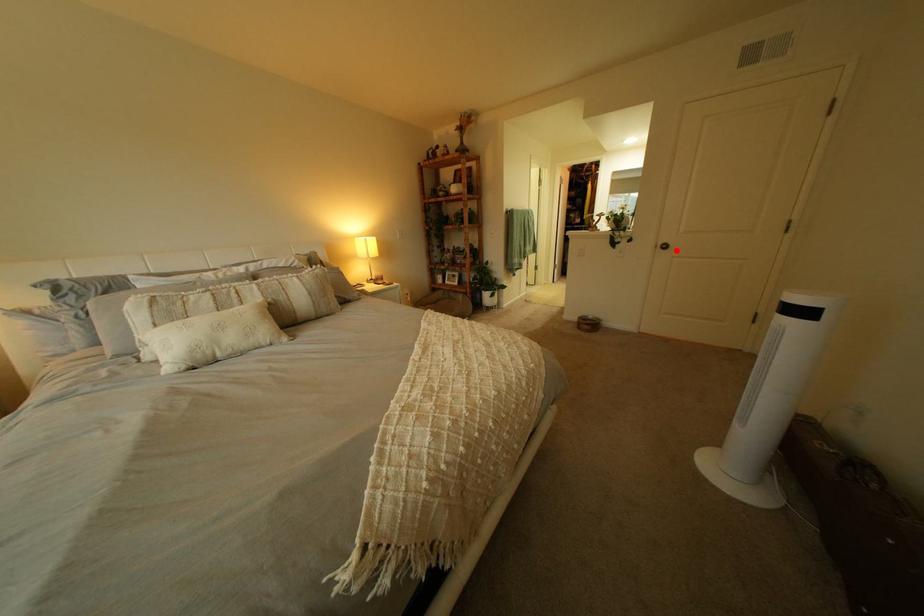
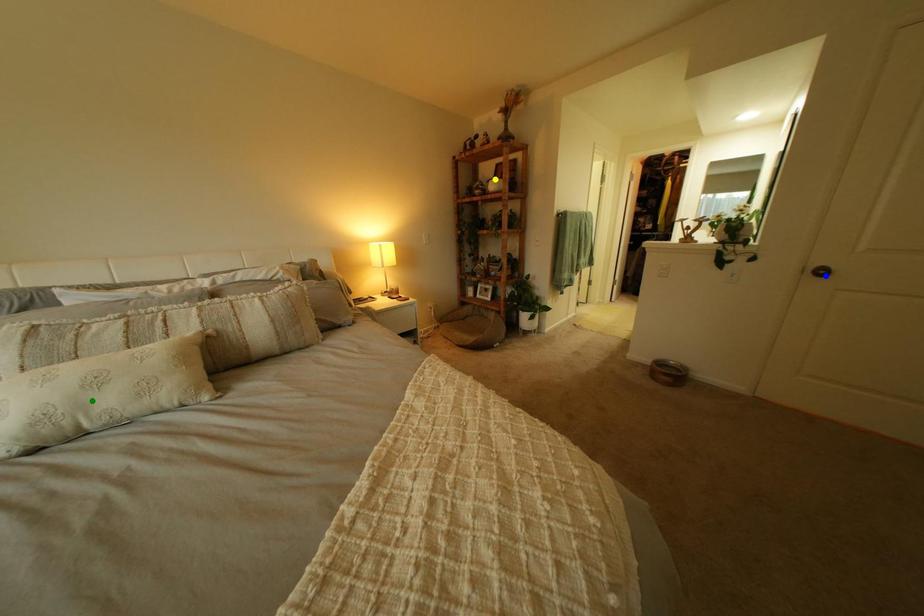
Question: I am providing you with two images of the same scene from different viewpoints. A red point is marked on the first image. You are given multiple points on the second image. Which point in image 2 represents the same 3d spot as the red point in image 1?

Choices:
 (A) green point
 (B) yellow point
 (C) blue point

Answer: (C)